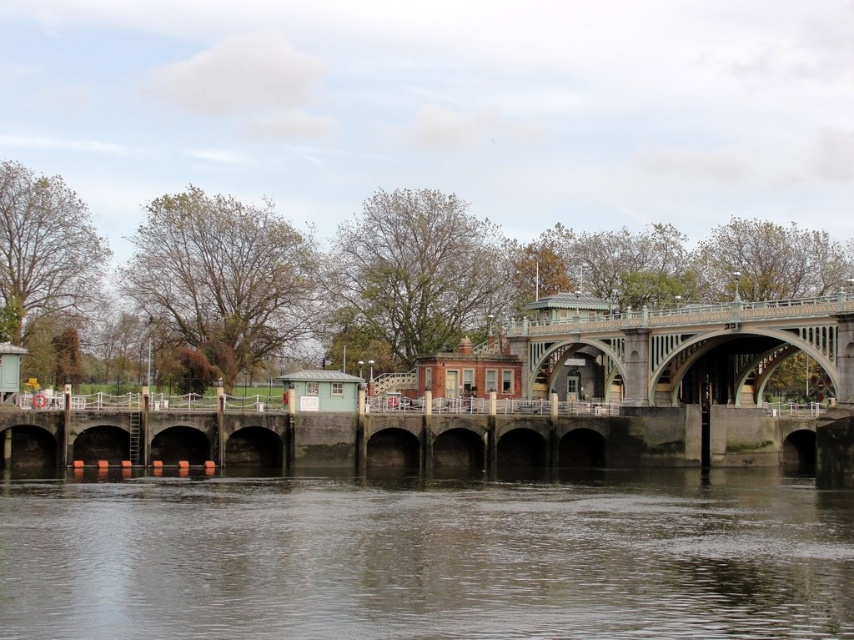
Question: Among these points, which one is farthest from the camera?

Choices:
 (A) (798, 554)
 (B) (642, 332)

Answer: (B)

Question: Is brown murky water at lower center closer to the viewer compared to green stone bridge at center?

Choices:
 (A) no
 (B) yes

Answer: (B)

Question: Is brown murky water at lower center smaller than green stone bridge at center?

Choices:
 (A) no
 (B) yes

Answer: (B)

Question: Which point appears farthest from the camera in this image?

Choices:
 (A) (650, 376)
 (B) (636, 600)

Answer: (A)

Question: Is brown murky water at lower center in front of green stone bridge at center?

Choices:
 (A) yes
 (B) no

Answer: (A)